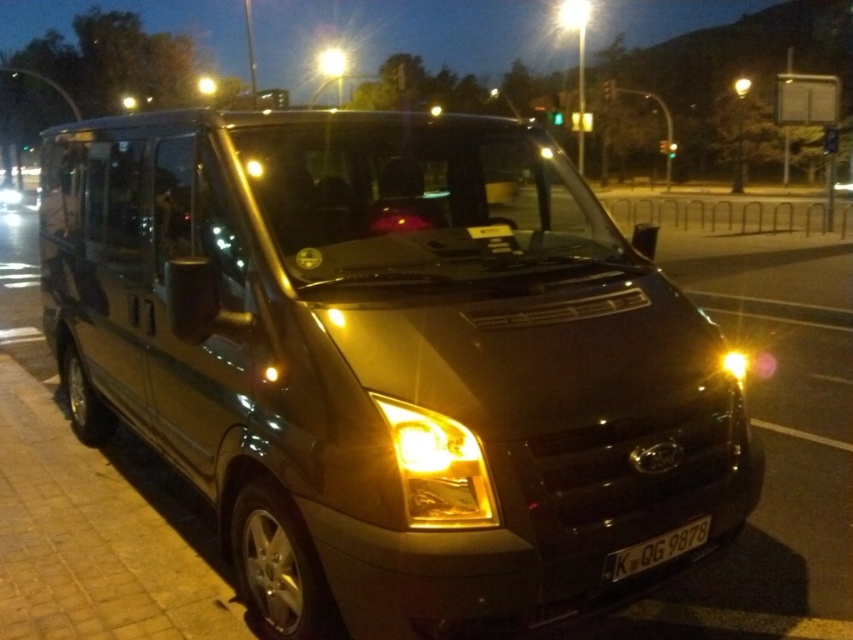
You are standing in front of the parked van and want to determine the distance between two points on the van. The first point is at coordinates point (496, 188), and the second is at point (633, 557). Which point is closer to you?

Point (633, 557) is closer to you because it is less further to the camera than point (496, 188).

You are a delivery driver who needs to park your metallic gold van at center between two other vehicles. There is a yellow translucent headlight at center in the parking spot. Can you safely park your van without hitting the headlight?

The metallic gold van at center is to the left of the yellow translucent headlight at center, so if the parking spot is designed to accommodate both, the van can be parked to the left side of the headlight without collision. However, ensure there is enough space between them.